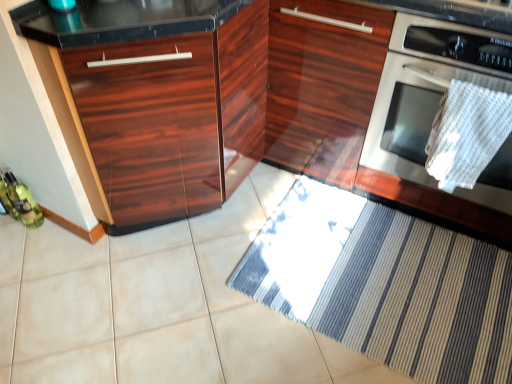
Question: From a real-world perspective, is glossy wood cabinet at left, marked as the 1th cabinetry in a left-to-right arrangement, beneath striped fabric doormat at lower center?

Choices:
 (A) no
 (B) yes

Answer: (A)

Question: Is glossy wood cabinet at left, which ranks as the second cabinetry in right-to-left order, oriented towards striped fabric doormat at lower center?

Choices:
 (A) no
 (B) yes

Answer: (B)

Question: Is glossy wood cabinet at left, marked as the 1th cabinetry in a left-to-right arrangement, oriented away from striped fabric doormat at lower center?

Choices:
 (A) yes
 (B) no

Answer: (B)

Question: Is there a large distance between glossy wood cabinet at left, marked as the 1th cabinetry in a left-to-right arrangement, and striped fabric doormat at lower center?

Choices:
 (A) yes
 (B) no

Answer: (B)

Question: Is glossy wood cabinet at left, which ranks as the second cabinetry in right-to-left order, taller than striped fabric doormat at lower center?

Choices:
 (A) no
 (B) yes

Answer: (B)

Question: Is stainless steel oven at right inside or outside of striped fabric doormat at lower center?

Choices:
 (A) outside
 (B) inside

Answer: (A)

Question: From a real-world perspective, is stainless steel oven at right physically located above or below striped fabric doormat at lower center?

Choices:
 (A) below
 (B) above

Answer: (B)

Question: From the image's perspective, is stainless steel oven at right located above or below striped fabric doormat at lower center?

Choices:
 (A) below
 (B) above

Answer: (B)

Question: In terms of size, does stainless steel oven at right appear bigger or smaller than striped fabric doormat at lower center?

Choices:
 (A) big
 (B) small

Answer: (A)

Question: From the image's perspective, is glossy wood cabinet at left, marked as the 1th cabinetry in a left-to-right arrangement, positioned above or below stainless steel oven at right?

Choices:
 (A) below
 (B) above

Answer: (A)

Question: In the image, is glossy wood cabinet at left, which ranks as the second cabinetry in right-to-left order, on the left side or the right side of stainless steel oven at right?

Choices:
 (A) right
 (B) left

Answer: (B)

Question: In terms of height, does glossy wood cabinet at left, marked as the 1th cabinetry in a left-to-right arrangement, look taller or shorter compared to stainless steel oven at right?

Choices:
 (A) short
 (B) tall

Answer: (B)

Question: Would you say glossy wood cabinet at left, which ranks as the second cabinetry in right-to-left order, is inside or outside stainless steel oven at right?

Choices:
 (A) inside
 (B) outside

Answer: (B)

Question: Is white woven towel at right taller or shorter than stainless steel oven at right?

Choices:
 (A) short
 (B) tall

Answer: (A)

Question: Is white woven towel at right in front of or behind stainless steel oven at right in the image?

Choices:
 (A) behind
 (B) front

Answer: (A)